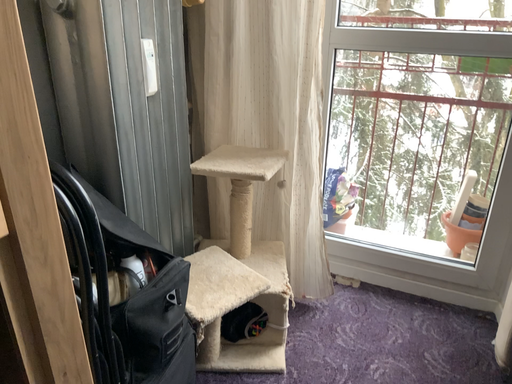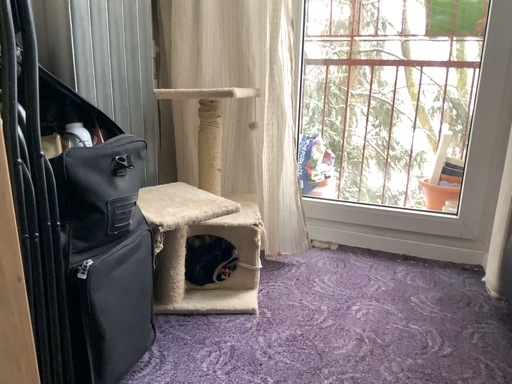
Question: How did the camera likely rotate when shooting the video?

Choices:
 (A) rotated upward
 (B) rotated downward

Answer: (A)